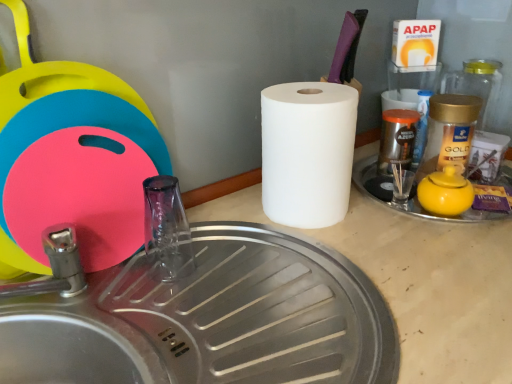
Identify the location of free space to the left of transparent glass faucet at center. The height and width of the screenshot is (384, 512). (106, 281).